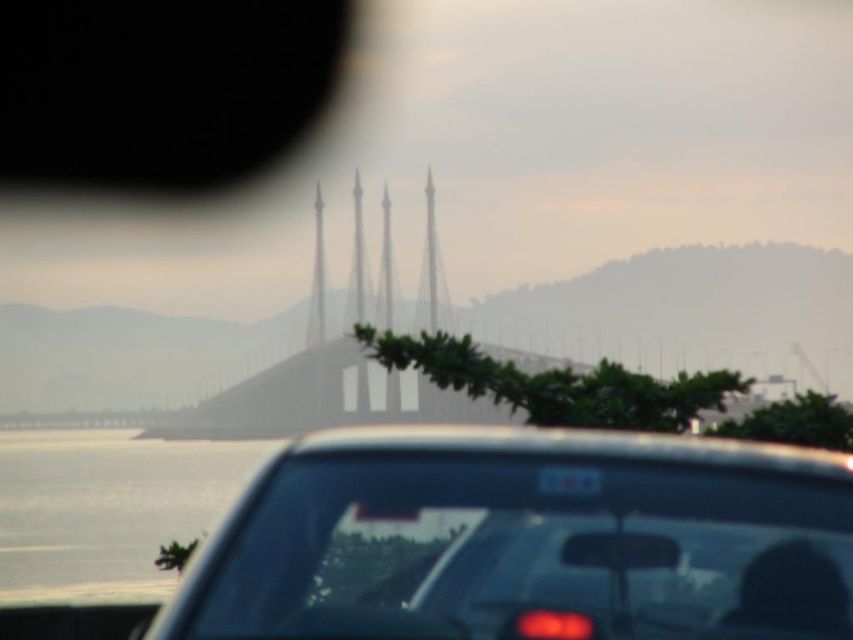
The image size is (853, 640). Describe the element at coordinates (526, 541) in the screenshot. I see `matte black car at center` at that location.

Between matte black car at center and clear water at lower left, which one has less height?

matte black car at center

Is point (657, 605) closer to viewer compared to point (221, 509)?

Yes.

Locate an element on the screen. This screenshot has height=640, width=853. matte black car at center is located at coordinates (526, 541).

Is point (230, 477) less distant than point (575, 486)?

No, it is behind (575, 486).

This screenshot has height=640, width=853. I want to click on clear water at lower left, so click(106, 509).

Between point (229, 524) and point (566, 477), which one is positioned in front?

Point (566, 477) is in front.

This screenshot has height=640, width=853. In order to click on matte black car at center in this screenshot , I will do `click(526, 541)`.